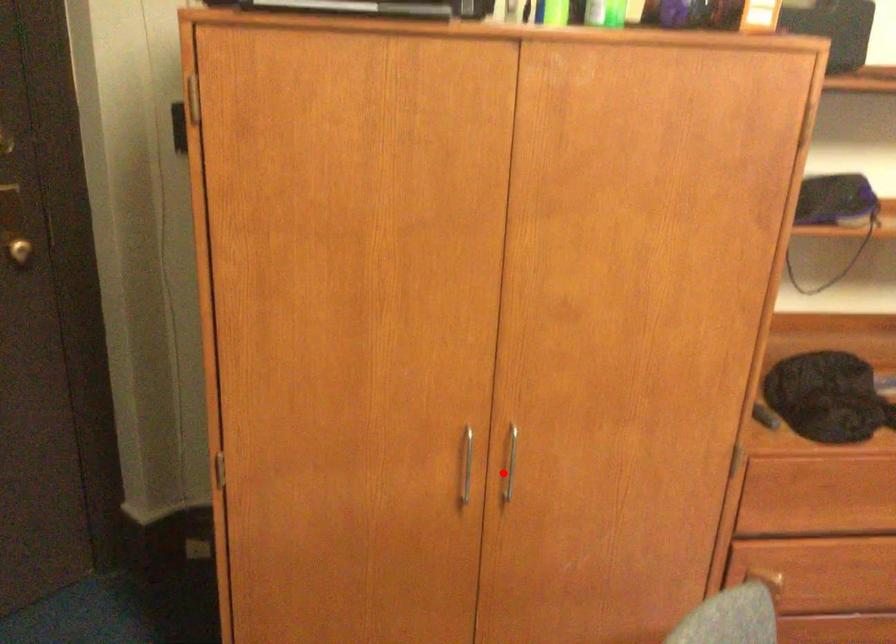
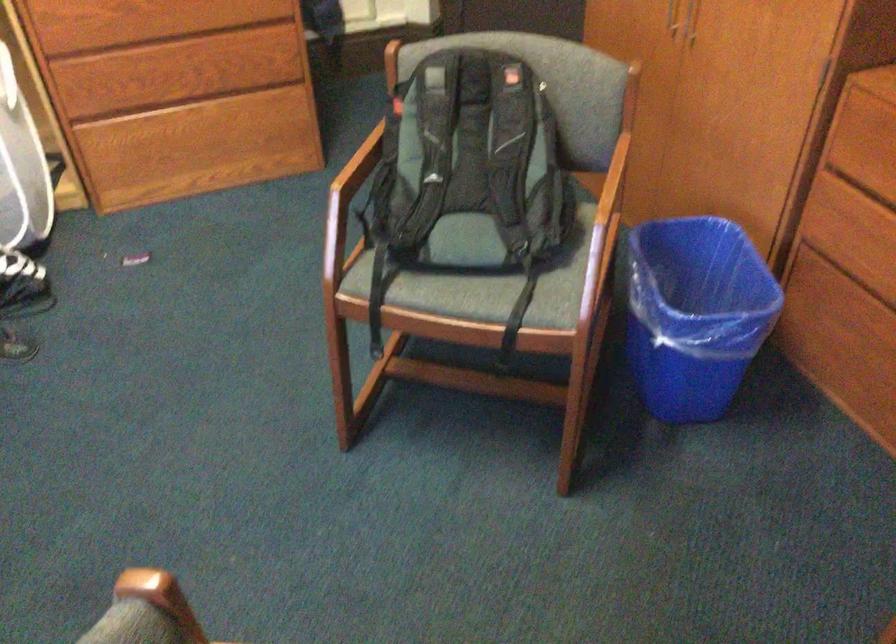
Question: I am providing you with two images of the same scene from different viewpoints. Given a red point in image1, look at the same physical point in image2. Is it:

Choices:
 (A) Closer to the viewpoint
 (B) Farther from the viewpoint

Answer: (B)